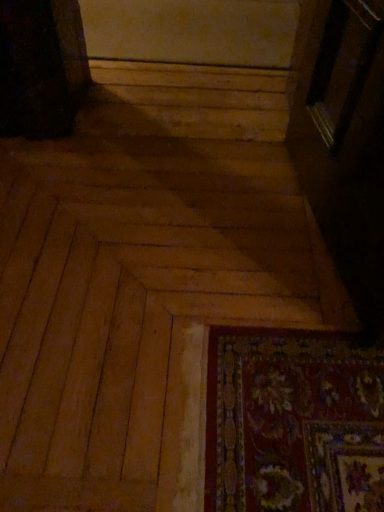
This screenshot has height=512, width=384. Find the location of `vacant region to the left of wooden screen door at right`. vacant region to the left of wooden screen door at right is located at coordinates (187, 229).